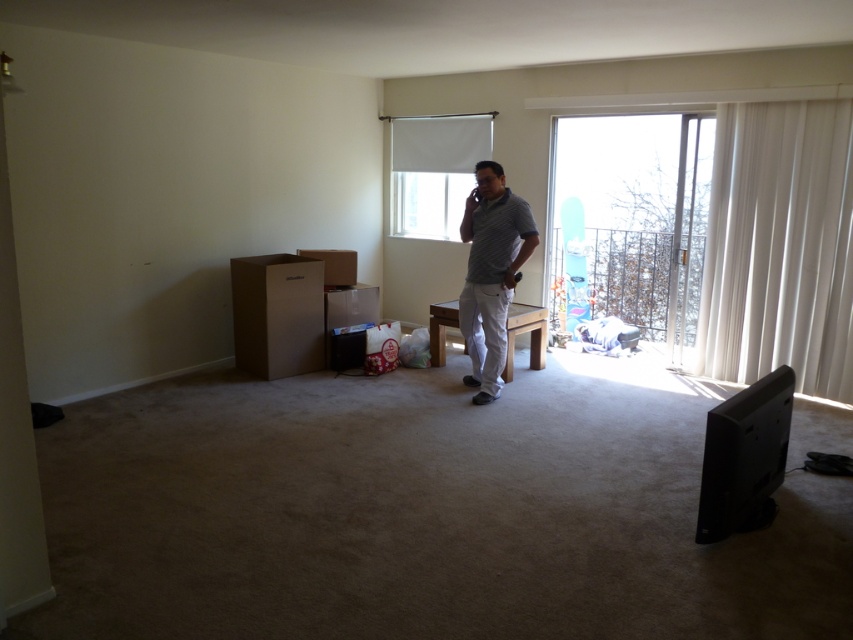
You are moving into a new apartment and need to place a 2.5 meter long sofa between the transparent glass window at right and the white matte window at center. Can the sofa fit horizontally between them?

The transparent glass window at right and white matte window at center are 2.53 meters apart from each other. Since the sofa is 2.5 meters long, it can fit horizontally between them as the distance is slightly larger than the sofa length.

You are moving into a new apartment and need to decide where to place your large sofa. The sofa is 2 meters wide. You want to ensure it fits in front of a window. Which window should you choose between the transparent glass window at right and the white matte window at center?

The transparent glass window at right is bigger than the white matte window at center, so the sofa will fit better in front of the transparent glass window at right.